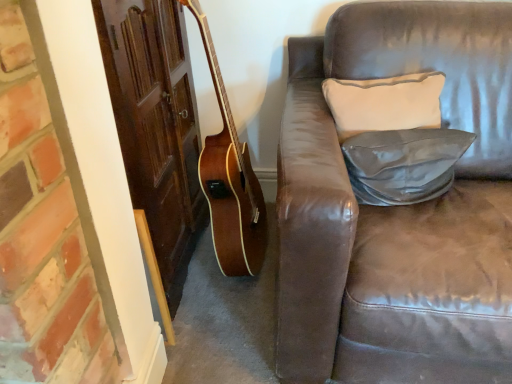
In order to face light beige fabric pillow at upper right, the 1th pillow positioned from the top, should I rotate leftwards or rightwards?

To face it directly, rotate right by 16.554 degrees.

Image resolution: width=512 pixels, height=384 pixels. What do you see at coordinates (384, 103) in the screenshot?
I see `light beige fabric pillow at upper right, arranged as the 2th pillow when ordered from the bottom` at bounding box center [384, 103].

You are a GUI agent. You are given a task and a screenshot of the screen. Output one action in this format:
    pyautogui.click(x=<x>, y=<y>)
    Task: Click on the light beige fabric pillow at upper right, the 1th pillow positioned from the top
    This screenshot has height=384, width=512.
    Given the screenshot: What is the action you would take?
    pyautogui.click(x=384, y=103)

Find the location of a particular element. The width and height of the screenshot is (512, 384). leather-like gray pillow at center-right, positioned as the 2th pillow in top-to-bottom order is located at coordinates (403, 164).

What do you see at coordinates (403, 164) in the screenshot? I see `leather-like gray pillow at center-right, positioned as the 2th pillow in top-to-bottom order` at bounding box center [403, 164].

How much space does leather-like gray pillow at center-right, placed as the first pillow when sorted from bottom to top, occupy vertically?

The height of leather-like gray pillow at center-right, placed as the first pillow when sorted from bottom to top, is 6.72 inches.

Measure the distance between leather-like gray pillow at center-right, placed as the first pillow when sorted from bottom to top, and camera.

A distance of 1.05 meters exists between leather-like gray pillow at center-right, placed as the first pillow when sorted from bottom to top, and camera.

Image resolution: width=512 pixels, height=384 pixels. Identify the location of light beige fabric pillow at upper right, arranged as the 2th pillow when ordered from the bottom. (384, 103).

Does light beige fabric pillow at upper right, the 1th pillow positioned from the top, appear on the right side of leather-like gray pillow at center-right, placed as the first pillow when sorted from bottom to top?

No.

Considering their positions, is light beige fabric pillow at upper right, arranged as the 2th pillow when ordered from the bottom, located in front of or behind leather-like gray pillow at center-right, placed as the first pillow when sorted from bottom to top?

Visually, light beige fabric pillow at upper right, arranged as the 2th pillow when ordered from the bottom, is located behind leather-like gray pillow at center-right, placed as the first pillow when sorted from bottom to top.

Does point (372, 112) lie behind point (350, 141)?

That is True.

From the image's perspective, which is above, light beige fabric pillow at upper right, arranged as the 2th pillow when ordered from the bottom, or leather-like gray pillow at center-right, placed as the first pillow when sorted from bottom to top?

light beige fabric pillow at upper right, arranged as the 2th pillow when ordered from the bottom.

Looking at this image, from a real-world perspective, which object rests below the other?

leather-like gray pillow at center-right, positioned as the 2th pillow in top-to-bottom order.

Can you confirm if light beige fabric pillow at upper right, the 1th pillow positioned from the top, is wider than leather-like gray pillow at center-right, placed as the first pillow when sorted from bottom to top?

Yes.

Looking at this image, in terms of height, does light beige fabric pillow at upper right, the 1th pillow positioned from the top, look taller or shorter compared to leather-like gray pillow at center-right, placed as the first pillow when sorted from bottom to top?

In the image, light beige fabric pillow at upper right, the 1th pillow positioned from the top, appears to be taller than leather-like gray pillow at center-right, placed as the first pillow when sorted from bottom to top.

From the picture: Does light beige fabric pillow at upper right, arranged as the 2th pillow when ordered from the bottom, have a smaller size compared to leather-like gray pillow at center-right, placed as the first pillow when sorted from bottom to top?

No, light beige fabric pillow at upper right, arranged as the 2th pillow when ordered from the bottom, is not smaller than leather-like gray pillow at center-right, placed as the first pillow when sorted from bottom to top.

Does light beige fabric pillow at upper right, arranged as the 2th pillow when ordered from the bottom, contain leather-like gray pillow at center-right, positioned as the 2th pillow in top-to-bottom order?

No, leather-like gray pillow at center-right, positioned as the 2th pillow in top-to-bottom order, is not a part of light beige fabric pillow at upper right, arranged as the 2th pillow when ordered from the bottom.

Is there a large distance between light beige fabric pillow at upper right, arranged as the 2th pillow when ordered from the bottom, and leather-like gray pillow at center-right, positioned as the 2th pillow in top-to-bottom order?

That's not correct — light beige fabric pillow at upper right, arranged as the 2th pillow when ordered from the bottom, is a little close to leather-like gray pillow at center-right, positioned as the 2th pillow in top-to-bottom order.

Is light beige fabric pillow at upper right, arranged as the 2th pillow when ordered from the bottom, facing towards leather-like gray pillow at center-right, positioned as the 2th pillow in top-to-bottom order?

Yes, light beige fabric pillow at upper right, arranged as the 2th pillow when ordered from the bottom, is facing leather-like gray pillow at center-right, positioned as the 2th pillow in top-to-bottom order.

What are the coordinates of `pillow to the left of leather-like gray pillow at center-right, placed as the first pillow when sorted from bottom to top` in the screenshot? It's located at (384, 103).

Considering the relative positions of leather-like gray pillow at center-right, positioned as the 2th pillow in top-to-bottom order, and light beige fabric pillow at upper right, the 1th pillow positioned from the top, in the image provided, is leather-like gray pillow at center-right, positioned as the 2th pillow in top-to-bottom order, to the left or to the right of light beige fabric pillow at upper right, the 1th pillow positioned from the top,?

In the image, leather-like gray pillow at center-right, positioned as the 2th pillow in top-to-bottom order, appears on the right side of light beige fabric pillow at upper right, the 1th pillow positioned from the top.

Which object is more forward, leather-like gray pillow at center-right, placed as the first pillow when sorted from bottom to top, or light beige fabric pillow at upper right, arranged as the 2th pillow when ordered from the bottom?

leather-like gray pillow at center-right, placed as the first pillow when sorted from bottom to top, is closer to the camera.

Does point (357, 136) come in front of point (343, 82)?

That is True.

From the image's perspective, which one is positioned higher, leather-like gray pillow at center-right, placed as the first pillow when sorted from bottom to top, or light beige fabric pillow at upper right, the 1th pillow positioned from the top?

From the image's view, light beige fabric pillow at upper right, the 1th pillow positioned from the top, is above.

Based on the photo, from a real-world perspective, is leather-like gray pillow at center-right, positioned as the 2th pillow in top-to-bottom order, above or below light beige fabric pillow at upper right, arranged as the 2th pillow when ordered from the bottom?

In terms of real-world spatial position, leather-like gray pillow at center-right, positioned as the 2th pillow in top-to-bottom order, is below light beige fabric pillow at upper right, arranged as the 2th pillow when ordered from the bottom.

Considering the sizes of leather-like gray pillow at center-right, positioned as the 2th pillow in top-to-bottom order, and light beige fabric pillow at upper right, arranged as the 2th pillow when ordered from the bottom, in the image, is leather-like gray pillow at center-right, positioned as the 2th pillow in top-to-bottom order, wider or thinner than light beige fabric pillow at upper right, arranged as the 2th pillow when ordered from the bottom,?

leather-like gray pillow at center-right, positioned as the 2th pillow in top-to-bottom order, is thinner than light beige fabric pillow at upper right, arranged as the 2th pillow when ordered from the bottom.

Is leather-like gray pillow at center-right, placed as the first pillow when sorted from bottom to top, shorter than light beige fabric pillow at upper right, the 1th pillow positioned from the top?

Indeed, leather-like gray pillow at center-right, placed as the first pillow when sorted from bottom to top, has a lesser height compared to light beige fabric pillow at upper right, the 1th pillow positioned from the top.

In the scene shown: Can you confirm if leather-like gray pillow at center-right, placed as the first pillow when sorted from bottom to top, is smaller than light beige fabric pillow at upper right, arranged as the 2th pillow when ordered from the bottom?

Correct, leather-like gray pillow at center-right, placed as the first pillow when sorted from bottom to top, occupies less space than light beige fabric pillow at upper right, arranged as the 2th pillow when ordered from the bottom.

Can we say leather-like gray pillow at center-right, positioned as the 2th pillow in top-to-bottom order, lies outside light beige fabric pillow at upper right, the 1th pillow positioned from the top?

leather-like gray pillow at center-right, positioned as the 2th pillow in top-to-bottom order, is positioned outside light beige fabric pillow at upper right, the 1th pillow positioned from the top.

Is leather-like gray pillow at center-right, placed as the first pillow when sorted from bottom to top, next to light beige fabric pillow at upper right, the 1th pillow positioned from the top, and touching it?

No.

Is light beige fabric pillow at upper right, the 1th pillow positioned from the top, at the back of leather-like gray pillow at center-right, placed as the first pillow when sorted from bottom to top?

Yes, leather-like gray pillow at center-right, placed as the first pillow when sorted from bottom to top, is positioned with its back facing light beige fabric pillow at upper right, the 1th pillow positioned from the top.

Identify the location of pillow lying above the leather-like gray pillow at center-right, positioned as the 2th pillow in top-to-bottom order (from the image's perspective). This screenshot has height=384, width=512. (384, 103).

I want to click on pillow directly beneath the light beige fabric pillow at upper right, arranged as the 2th pillow when ordered from the bottom (from a real-world perspective), so click(x=403, y=164).

I want to click on pillow on the right side of light beige fabric pillow at upper right, arranged as the 2th pillow when ordered from the bottom, so click(x=403, y=164).